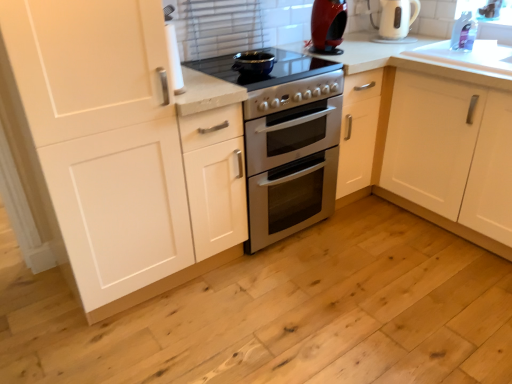
The image size is (512, 384). Identify the location of free space in front of white matte cabinet at left. (109, 345).